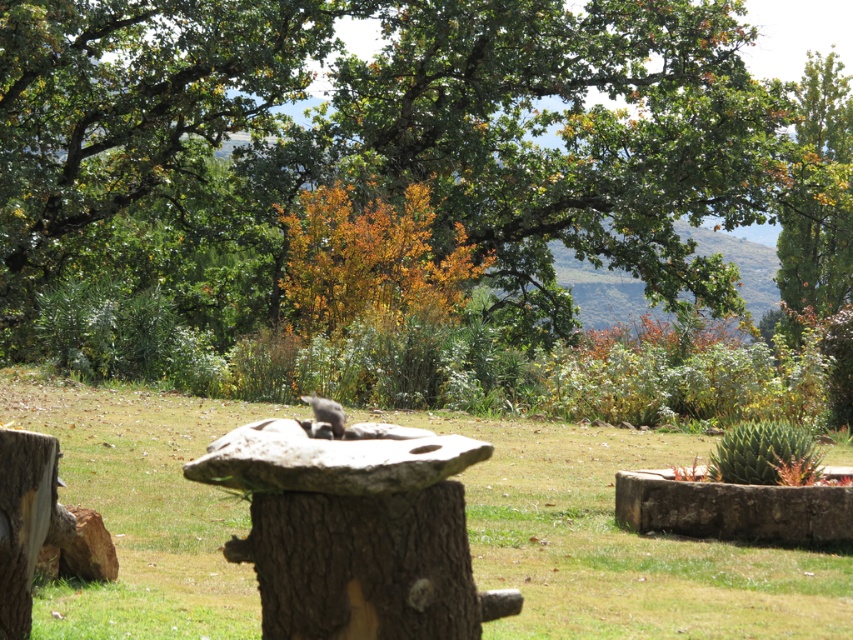
Question: Estimate the real-world distances between objects in this image. Which object is closer to the green leafy tree at upper center?

Choices:
 (A) smooth stone stump at center
 (B) green grassy at center
 (C) fuzzy gray cat at center

Answer: (B)

Question: Is brown rough tree trunk at center thinner than green leafy tree at upper right?

Choices:
 (A) no
 (B) yes

Answer: (B)

Question: Which point appears closest to the camera in this image?

Choices:
 (A) (807, 252)
 (B) (340, 406)
 (C) (444, 637)
 (D) (656, 461)

Answer: (C)

Question: Is green grassy at center further to the viewer compared to fuzzy gray cat at center?

Choices:
 (A) no
 (B) yes

Answer: (A)

Question: Which object is the farthest from the brown rough tree trunk at center?

Choices:
 (A) smooth stone stump at center
 (B) green leafy tree at upper center
 (C) fuzzy gray cat at center
 (D) green grassy at center

Answer: (B)

Question: Is brown rough tree trunk at center to the right of green leafy tree at upper right from the viewer's perspective?

Choices:
 (A) yes
 (B) no

Answer: (B)